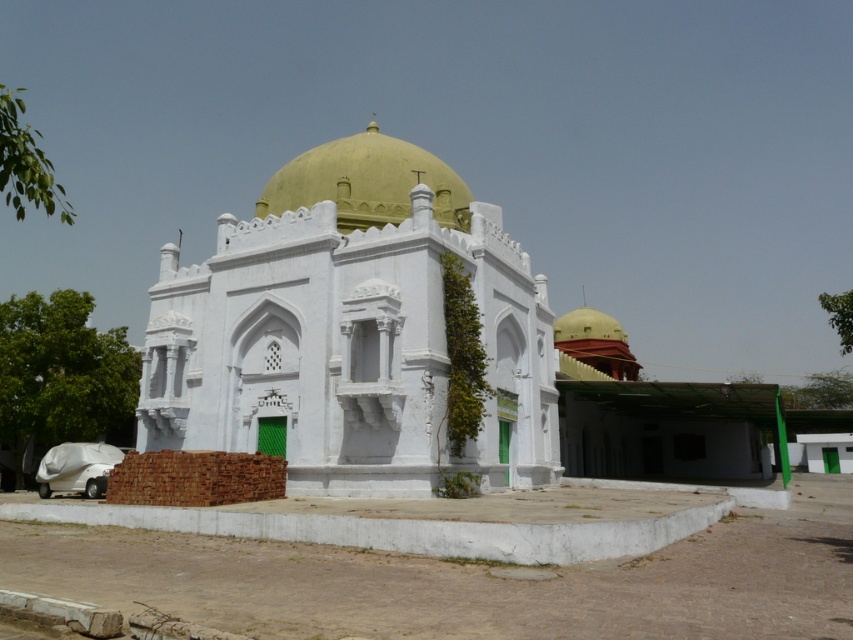
You are standing in front of the mosque and want to locate the white stone dome at center. According to the coordinates provided, where would you look?

The white stone dome at center is located at coordinates point (350, 330).

You are an architect designing a new building that needs to match the existing structures in the scene. The white stone dome at center and the golden polished dome at center are both part of the design. Which dome should you use if you want a thinner structure for a specific part of the building?

The white stone dome at center is thinner than the golden polished dome at center, so you should use the white stone dome at center for the thinner structure.

You are standing in front of the mosque and want to take a photo that includes the white stone dome at center. If your camera can focus on objects up to 60 feet away, will the dome be in focus?

The white stone dome at center is 65.68 feet away from the viewer, which exceeds the camera focus limit of 60 feet. Therefore, the dome will not be in focus.